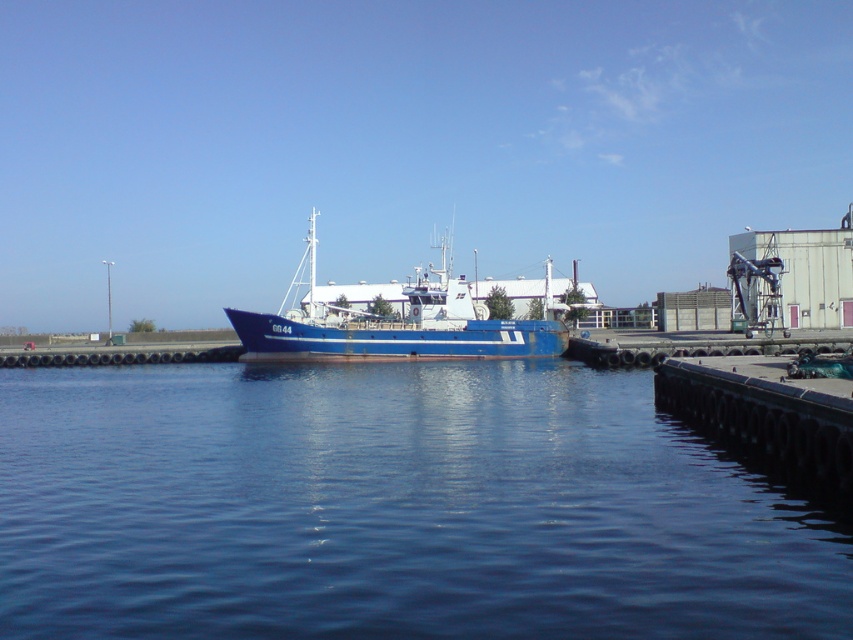
Can you confirm if blue water at center is taller than blue matte boat at center?

Incorrect, blue water at center's height is not larger of blue matte boat at center's.

Can you confirm if blue water at center is shorter than blue matte boat at center?

Correct, blue water at center is not as tall as blue matte boat at center.

Does point (548, 632) come farther from viewer compared to point (280, 324)?

No.

At what (x,y) coordinates should I click in order to perform the action: click on blue water at center. Please return your answer as a coordinate pair (x, y). The image size is (853, 640). Looking at the image, I should click on (392, 508).